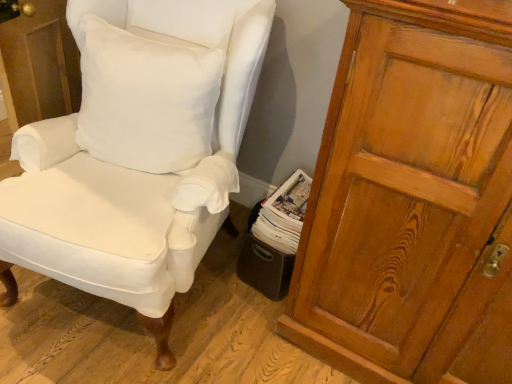
Question: Is wooden cupboard at right behind white paper magazine at lower center?

Choices:
 (A) yes
 (B) no

Answer: (B)

Question: From the image's perspective, does wooden cupboard at right appear higher than white paper magazine at lower center?

Choices:
 (A) yes
 (B) no

Answer: (A)

Question: Is there a large distance between wooden cupboard at right and white paper magazine at lower center?

Choices:
 (A) no
 (B) yes

Answer: (A)

Question: Does wooden cupboard at right have a smaller size compared to white paper magazine at lower center?

Choices:
 (A) yes
 (B) no

Answer: (B)

Question: Is wooden cupboard at right looking in the opposite direction of white paper magazine at lower center?

Choices:
 (A) no
 (B) yes

Answer: (A)

Question: From a real-world perspective, is wooden cupboard at right physically below white paper magazine at lower center?

Choices:
 (A) yes
 (B) no

Answer: (B)

Question: From the image's perspective, would you say white fabric chair at center is positioned over white paper magazine at lower center?

Choices:
 (A) yes
 (B) no

Answer: (A)

Question: Is the position of white fabric chair at center more distant than that of white paper magazine at lower center?

Choices:
 (A) no
 (B) yes

Answer: (A)

Question: Is white fabric chair at center facing towards white paper magazine at lower center?

Choices:
 (A) yes
 (B) no

Answer: (B)

Question: Does white fabric chair at center have a lesser height compared to white paper magazine at lower center?

Choices:
 (A) yes
 (B) no

Answer: (B)

Question: Considering the relative sizes of white fabric chair at center and white paper magazine at lower center in the image provided, is white fabric chair at center smaller than white paper magazine at lower center?

Choices:
 (A) no
 (B) yes

Answer: (A)

Question: Does white fabric chair at center appear on the left side of white paper magazine at lower center?

Choices:
 (A) no
 (B) yes

Answer: (B)

Question: Is white cotton pillow at upper left smaller than white paper magazine at lower center?

Choices:
 (A) no
 (B) yes

Answer: (A)